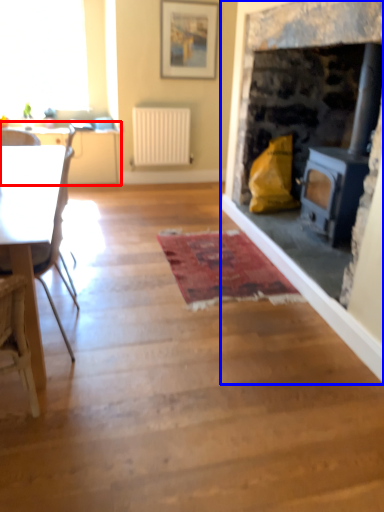
Question: Among these objects, which one is nearest to the camera, table (highlighted by a red box) or fireplace (highlighted by a blue box)?

Choices:
 (A) table
 (B) fireplace

Answer: (B)